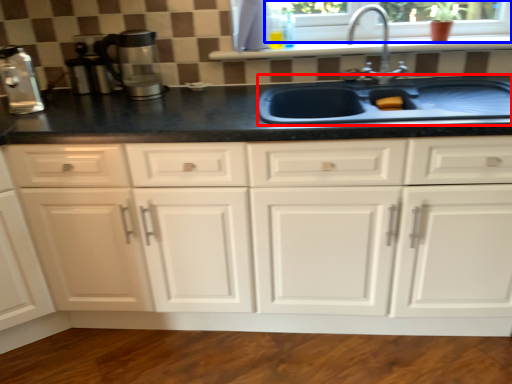
Question: Which object appears farthest to the camera in this image, sink (highlighted by a red box) or window frame (highlighted by a blue box)?

Choices:
 (A) sink
 (B) window frame

Answer: (B)